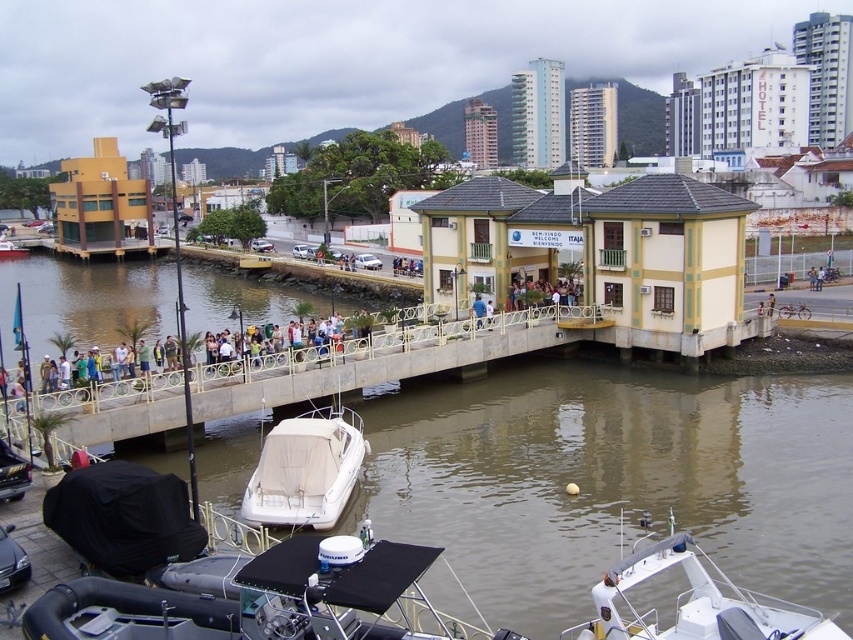
You are a drone operator and need to land your drone on the white concrete dock at center. The landing coordinates must be within a 0.1 radius of the center point. What are the coordinates you should target?

The coordinates to target are approximately (x=381, y=360), as the white concrete dock at center is positioned at that point.

Based on the photo, you are a tour guide explaining the scene to visitors. You want to highlight the relationship between the brown murky water at center and the white matte boat at center. What do you notice about their sizes?

The brown murky water at center is much taller than the white matte boat at center.

You are standing at point (3, 252) and want to walk to point (849, 632). According to the scene description, is the path between these two points clear of any obstacles?

Yes, the path between point (3, 252) and point (849, 632) is clear of obstacles because the scene describes a concrete walkway extending from the dock into the water, connecting to the building, implying a continuous path.